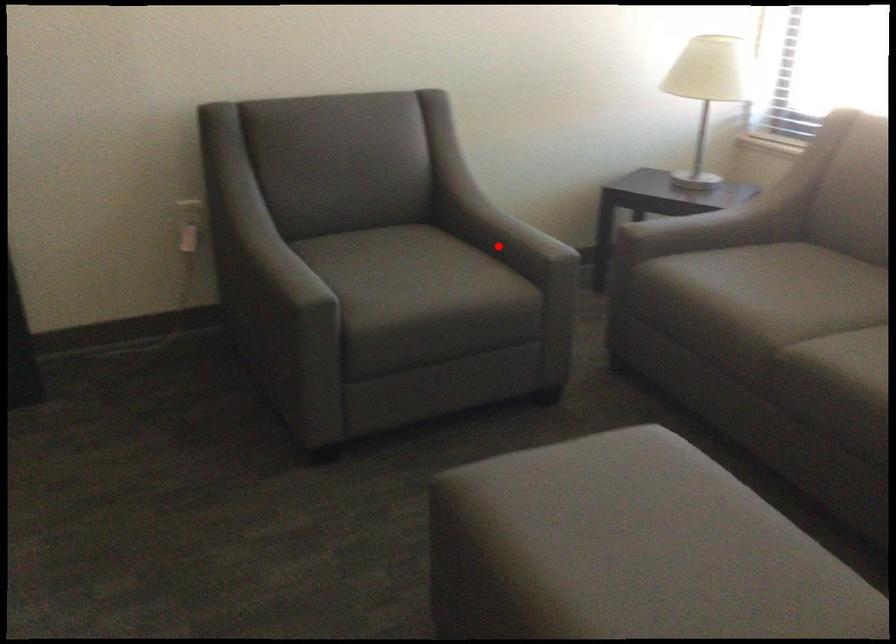
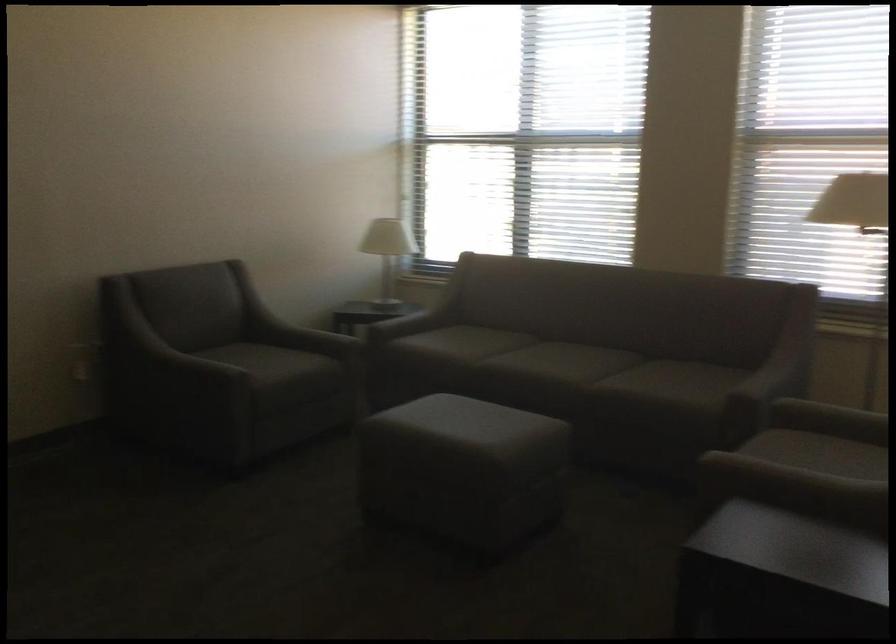
Find the pixel in the second image that matches the highlighted location in the first image.

(307, 339)